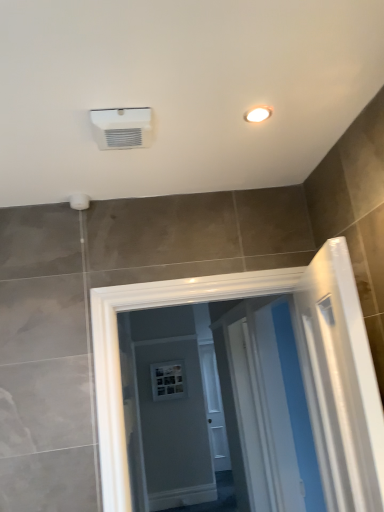
Question: Is white glossy screen door at center inside white glossy light fixture at upper right?

Choices:
 (A) yes
 (B) no

Answer: (B)

Question: Can you confirm if white glossy light fixture at upper right is shorter than white glossy screen door at center?

Choices:
 (A) yes
 (B) no

Answer: (A)

Question: From the image's perspective, would you say white glossy light fixture at upper right is shown under white glossy screen door at center?

Choices:
 (A) yes
 (B) no

Answer: (B)

Question: Could you tell me if white glossy light fixture at upper right is turned towards white glossy screen door at center?

Choices:
 (A) no
 (B) yes

Answer: (A)

Question: Is the depth of white glossy light fixture at upper right greater than that of white glossy screen door at center?

Choices:
 (A) no
 (B) yes

Answer: (A)

Question: From a real-world perspective, is white plastic air conditioning unit at upper center physically located above or below white glossy screen door at center?

Choices:
 (A) below
 (B) above

Answer: (B)

Question: Is point (94, 125) closer or farther from the camera than point (304, 441)?

Choices:
 (A) closer
 (B) farther

Answer: (A)

Question: Looking at their shapes, would you say white plastic air conditioning unit at upper center is wider or thinner than white glossy screen door at center?

Choices:
 (A) wide
 (B) thin

Answer: (B)

Question: Relative to white glossy screen door at center, is white plastic air conditioning unit at upper center in front or behind?

Choices:
 (A) front
 (B) behind

Answer: (A)

Question: Considering the positions of white glossy light fixture at upper right and white plastic air conditioning unit at upper center in the image, is white glossy light fixture at upper right bigger or smaller than white plastic air conditioning unit at upper center?

Choices:
 (A) big
 (B) small

Answer: (B)

Question: Is white glossy light fixture at upper right in front of or behind white plastic air conditioning unit at upper center in the image?

Choices:
 (A) front
 (B) behind

Answer: (B)

Question: From the image's perspective, relative to white plastic air conditioning unit at upper center, is white glossy light fixture at upper right above or below?

Choices:
 (A) below
 (B) above

Answer: (B)

Question: Would you say white glossy light fixture at upper right is inside or outside white plastic air conditioning unit at upper center?

Choices:
 (A) outside
 (B) inside

Answer: (A)

Question: Is white glossy screen door at center taller or shorter than white plastic air conditioning unit at upper center?

Choices:
 (A) short
 (B) tall

Answer: (B)

Question: Considering the relative positions of white glossy screen door at center and white plastic air conditioning unit at upper center in the image provided, is white glossy screen door at center to the left or to the right of white plastic air conditioning unit at upper center?

Choices:
 (A) left
 (B) right

Answer: (B)